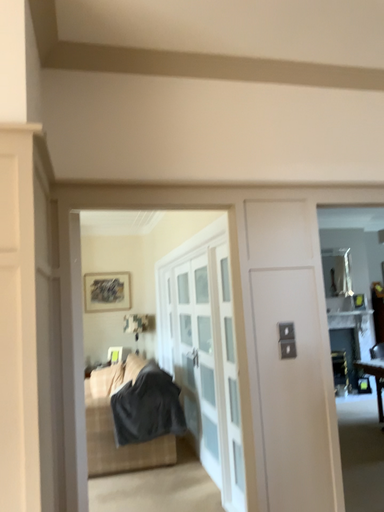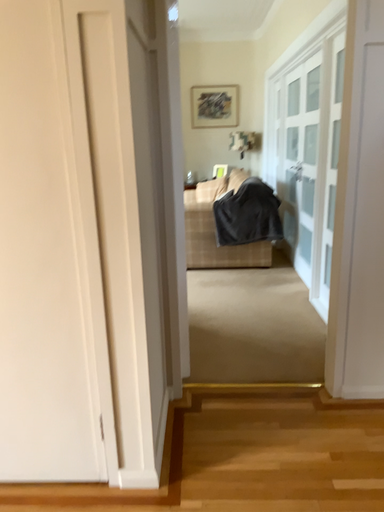
Question: Which way did the camera rotate in the video?

Choices:
 (A) rotated downward
 (B) rotated upward

Answer: (A)